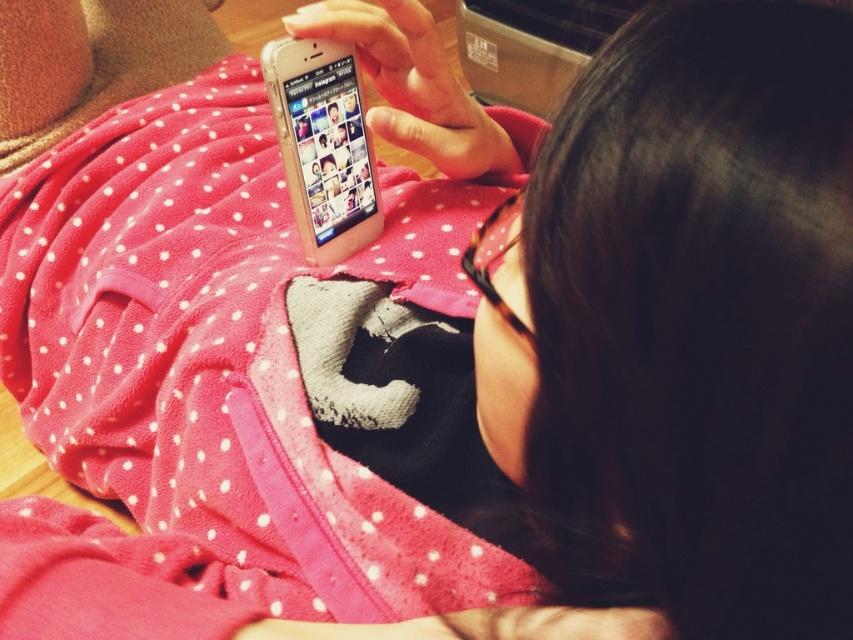
Does pink fleece blanket at center have a lesser height compared to clear plastic phone at center?

Incorrect, pink fleece blanket at center's height does not fall short of clear plastic phone at center's.

Which is in front, point (364, 550) or point (312, 145)?

Point (364, 550) is in front.

Does point (206, 566) come behind point (357, 148)?

No, (206, 566) is closer to viewer.

Where is `pink fleece blanket at center`? This screenshot has height=640, width=853. pink fleece blanket at center is located at coordinates (207, 385).